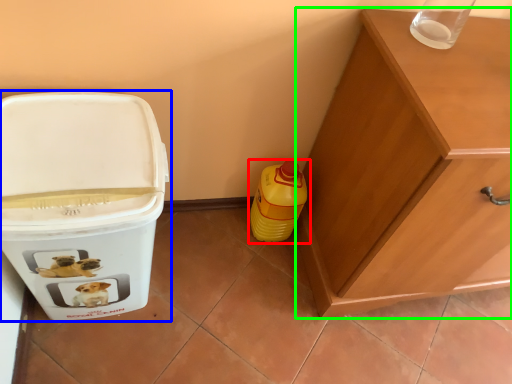
Question: Which object is positioned closest to bottle (highlighted by a red box)? Select from waste container (highlighted by a blue box) and cabinetry (highlighted by a green box).

Choices:
 (A) waste container
 (B) cabinetry

Answer: (B)